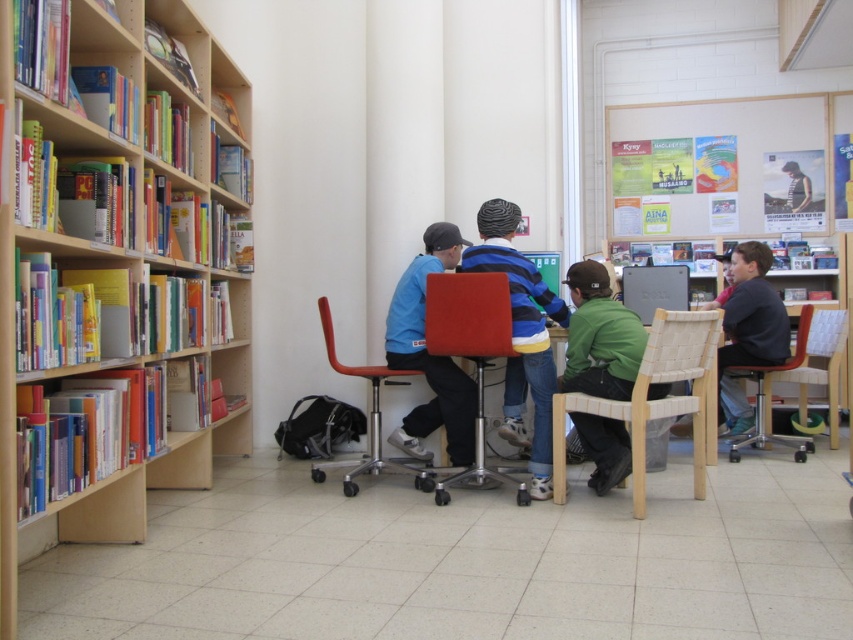
Consider the image. You are sitting at the wooden chair at right and want to reach the wooden bookshelf at left to grab a book. Which direction should you move to get there?

You should move to the left to reach the wooden bookshelf at left since it is located to the left of the wooden chair at right.

You are standing in the library and want to take a photo of both the bookshelf and the group at the table. Which point, point (451,429) or point (734,282), should you focus on to ensure both the bookshelf and the group are in focus?

You should focus on point (734,282) because it is farther from the camera than point (451,429). By focusing on the farther point, the depth of field will include both the closer and farther subjects, ensuring both the bookshelf and the group are in focus.

You are organizing a small event in the library and need to place a 1.5 meter wide table between the paper posters at upper center and the red fabric chair at center. Can the table fit horizontally between them?

The paper posters at upper center are wider than the red fabric chair at center. However, the description only provides information about their widths relative to each other, not their exact positions or distances apart. Without knowing the actual distance between them, it is impossible to determine if the 1.5 meter wide table can fit horizontally.